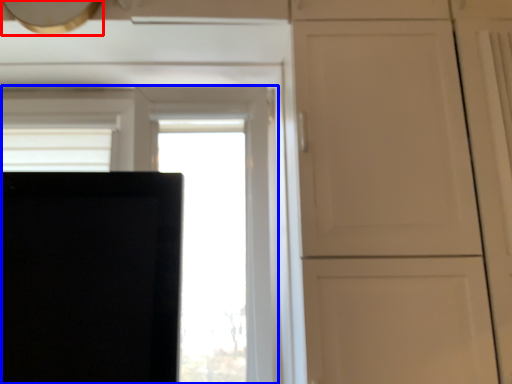
Question: Which object is closer to the camera taking this photo, exhaust hood (highlighted by a red box) or window (highlighted by a blue box)?

Choices:
 (A) exhaust hood
 (B) window

Answer: (A)